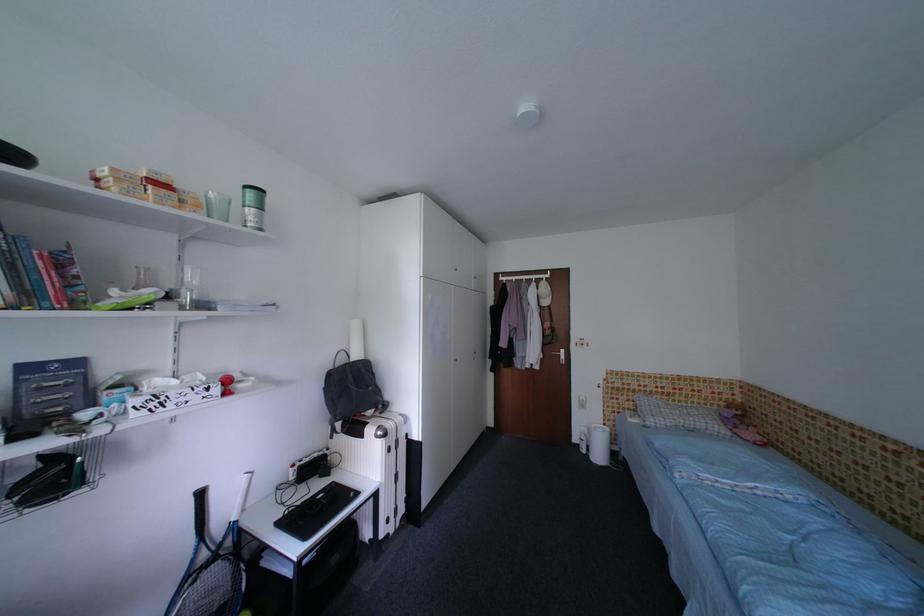
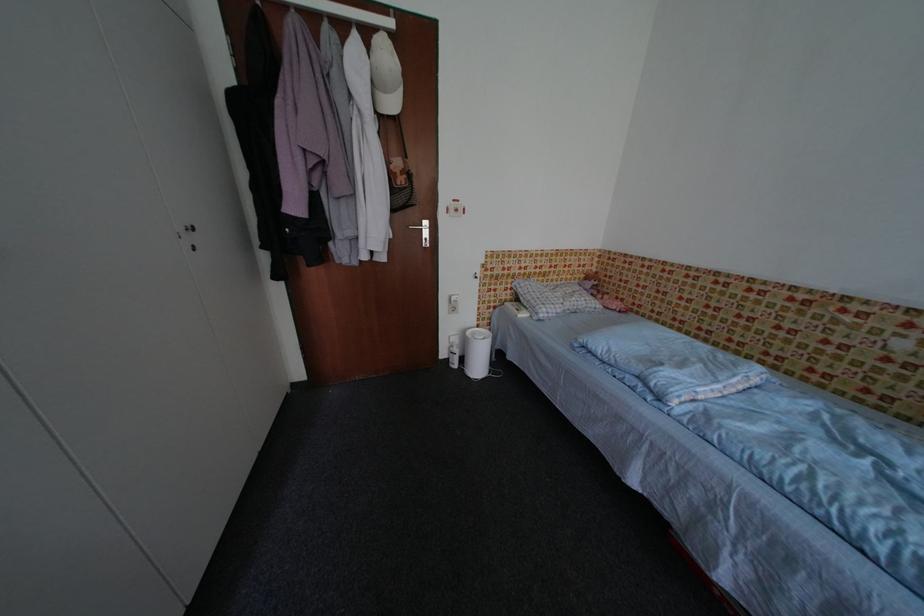
Find the pixel in the second image that matches the point at 591,432 in the first image.

(464, 342)